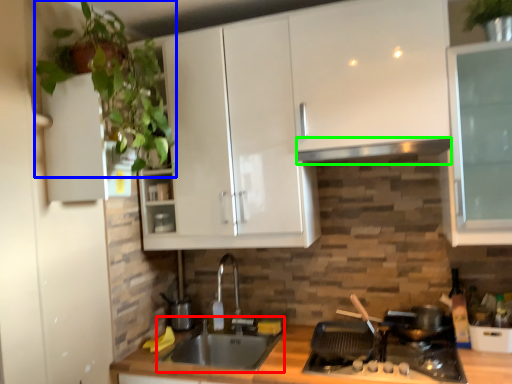
Question: Considering the real-world distances, which object is closest to sink (highlighted by a red box)? plant (highlighted by a blue box) or exhaust hood (highlighted by a green box).

Choices:
 (A) plant
 (B) exhaust hood

Answer: (B)